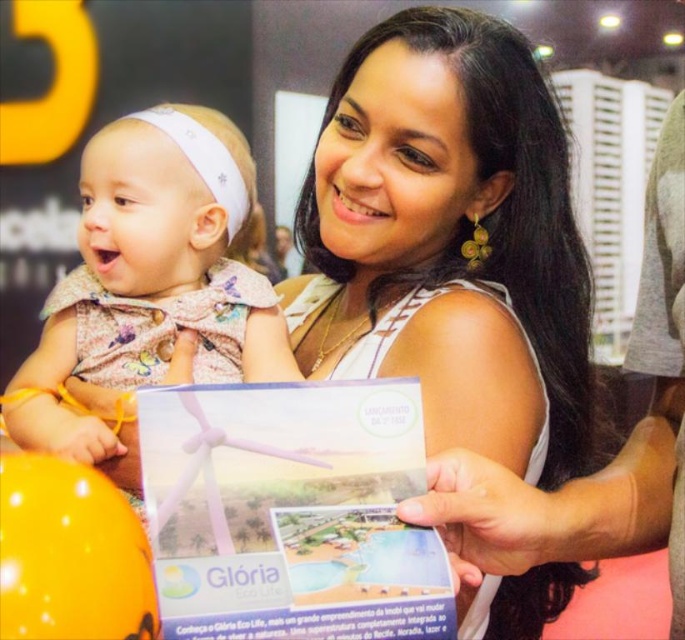
Question: Observing the image, what is the correct spatial positioning of matte white tank top at center in reference to matte white brochure at center?

Choices:
 (A) below
 (B) above

Answer: (B)

Question: Is matte white brochure at center to the left of matte pink dress at center from the viewer's perspective?

Choices:
 (A) no
 (B) yes

Answer: (A)

Question: Which point is closer to the camera?

Choices:
 (A) matte white brochure at center
 (B) matte pink dress at center
 (C) matte white tank top at center

Answer: (A)

Question: Estimate the real-world distances between objects in this image. Which object is closer to the matte white tank top at center?

Choices:
 (A) matte pink dress at center
 (B) matte white brochure at center

Answer: (A)

Question: Estimate the real-world distances between objects in this image. Which object is closer to the matte white tank top at center?

Choices:
 (A) matte white brochure at center
 (B) matte pink dress at center

Answer: (B)

Question: Is matte white tank top at center closer to the viewer compared to matte pink dress at center?

Choices:
 (A) no
 (B) yes

Answer: (A)